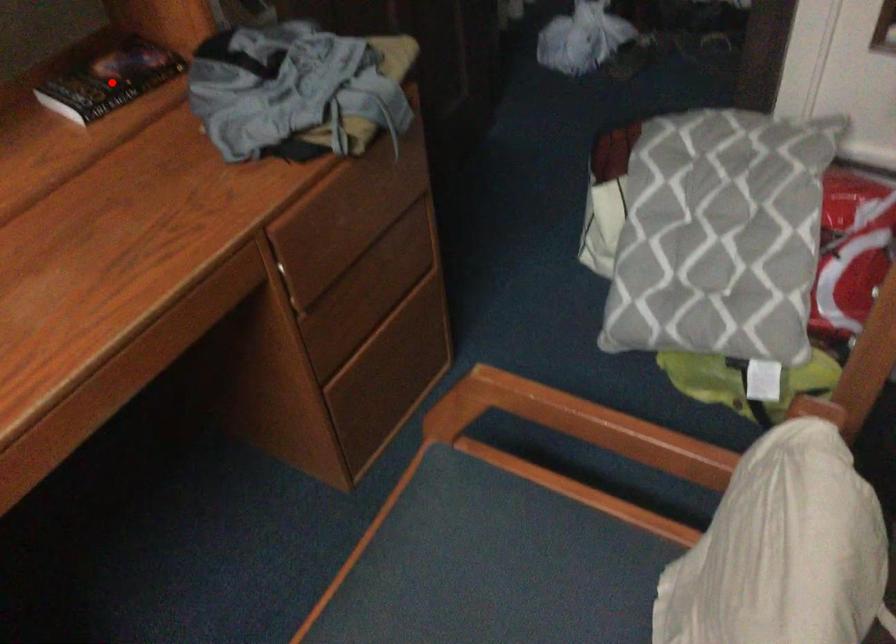
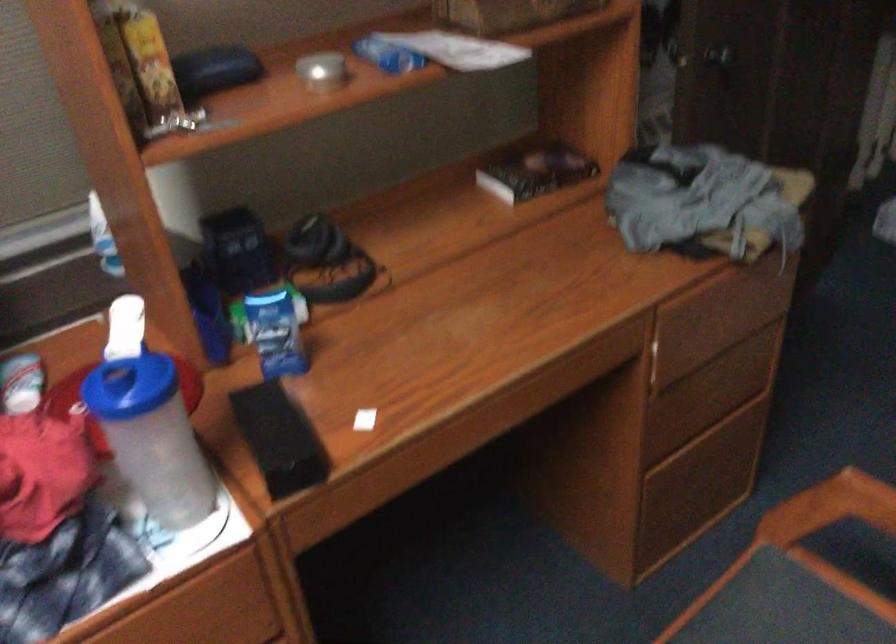
Question: I am providing you with two images of the same scene from different viewpoints. A red point is marked on the first image. Is the red point's position out of view in image 2?

Choices:
 (A) Yes
 (B) No

Answer: (B)